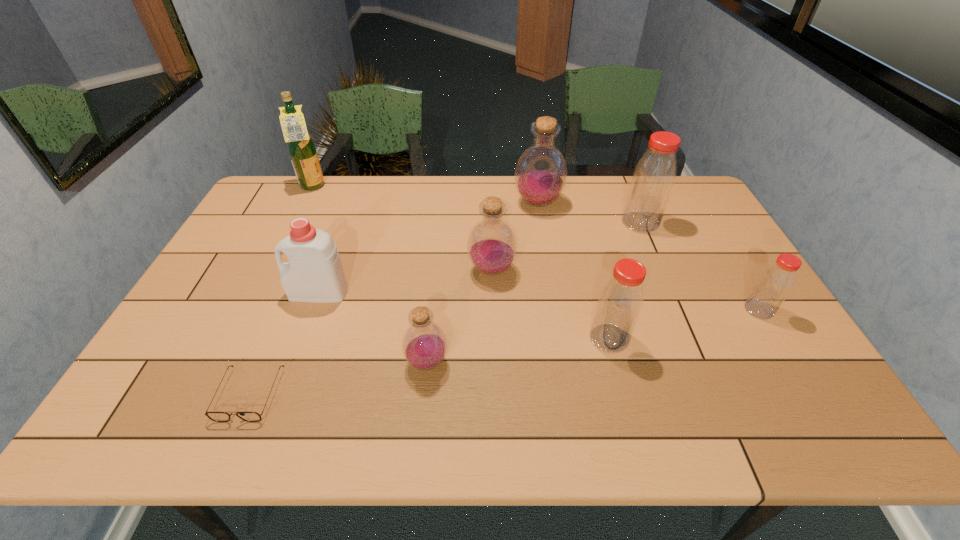
At what (x,y) coordinates should I click in order to perform the action: click on the rightmost object. Please return your answer as a coordinate pair (x, y). Looking at the image, I should click on (774, 285).

Locate an element on the screen. The width and height of the screenshot is (960, 540). the second nearest red bottle is located at coordinates (774, 285).

Find the location of a particular element. This screenshot has height=540, width=960. the smallest purple bottle is located at coordinates (424, 344).

Where is `the leftmost purple bottle`? the leftmost purple bottle is located at coordinates (424, 344).

This screenshot has height=540, width=960. In order to click on the shortest object in this screenshot , I will do pos(214,416).

Where is `blank space located on the front-facing side of the liquor`? This screenshot has width=960, height=540. blank space located on the front-facing side of the liquor is located at coordinates (343, 187).

Identify the location of vacant point located on the right of the rightmost purple bottle. The height and width of the screenshot is (540, 960). (577, 203).

At what (x,y) coordinates should I click in order to perform the action: click on vacant space located 0.110m on the front of the farthest red bottle. Please return your answer as a coordinate pair (x, y). The height and width of the screenshot is (540, 960). Looking at the image, I should click on (656, 257).

You are a GUI agent. You are given a task and a screenshot of the screen. Output one action in this format:
    pyautogui.click(x=<x>, y=<y>)
    Task: Click on the free space located on the handle side of the white detergent
    The image size is (960, 540).
    Given the screenshot: What is the action you would take?
    pyautogui.click(x=268, y=292)

Find the location of a particular element. The width and height of the screenshot is (960, 540). free space located on the handle side of the white detergent is located at coordinates (265, 292).